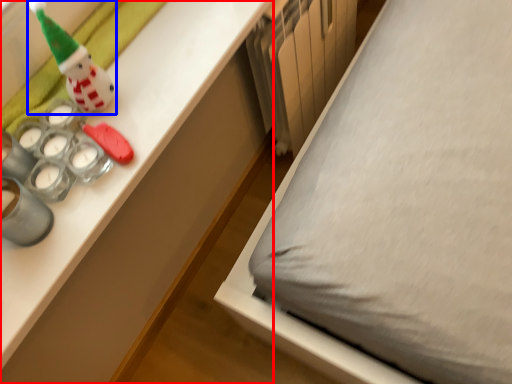
Question: Among these objects, which one is farthest to the camera, desk (highlighted by a red box) or toy (highlighted by a blue box)?

Choices:
 (A) desk
 (B) toy

Answer: (B)